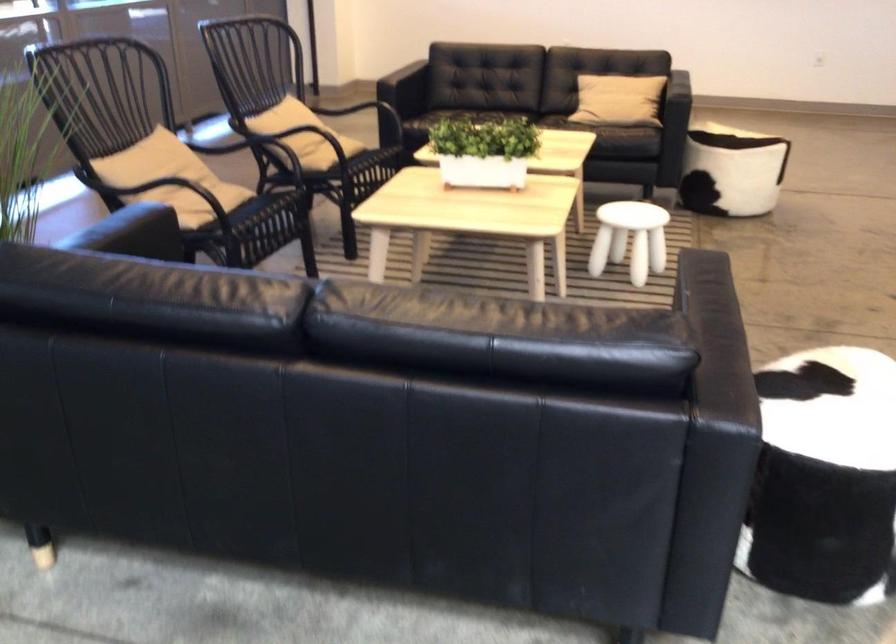
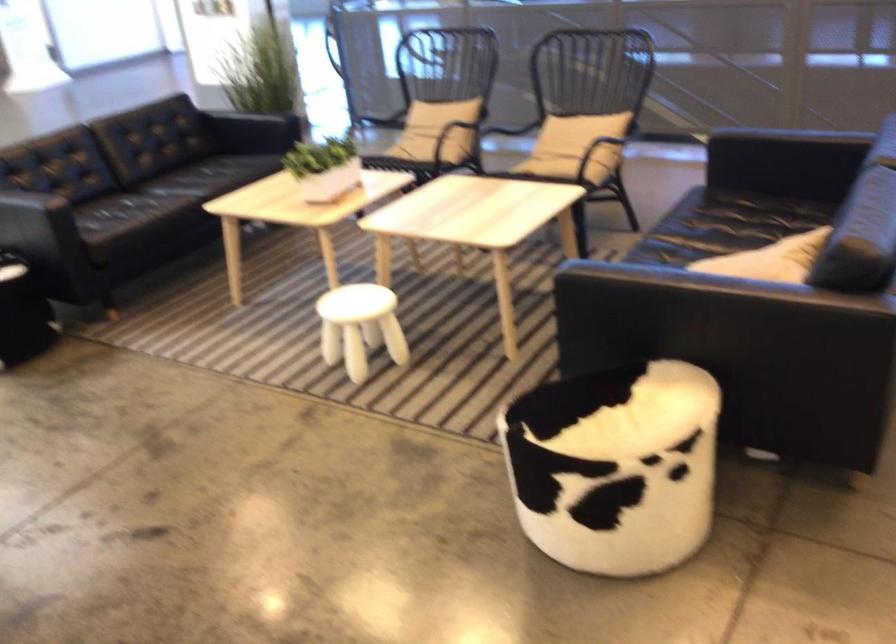
Locate, in the second image, the point that corresponds to the point at 221,180 in the first image.

(450, 135)